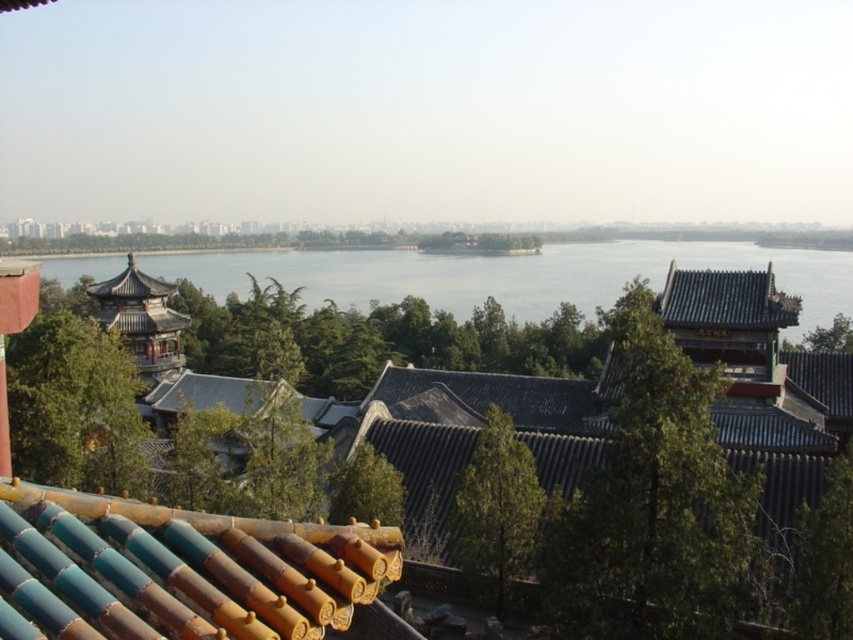
Question: Which point is farther to the camera?

Choices:
 (A) shiny dark blue tiled roof at upper right
 (B) blue water at center
 (C) teal glazed tiles at center

Answer: (B)

Question: In this image, where is teal glazed tiles at center located relative to shiny dark blue tiled roof at upper right?

Choices:
 (A) above
 (B) below

Answer: (B)

Question: Which point is farther to the camera?

Choices:
 (A) shiny dark blue tiled roof at upper right
 (B) teal glazed tiles at center

Answer: (A)

Question: Among these points, which one is nearest to the camera?

Choices:
 (A) (491, 272)
 (B) (90, 573)

Answer: (B)

Question: From the image, what is the correct spatial relationship of teal glazed tiles at center in relation to blue water at center?

Choices:
 (A) above
 (B) below

Answer: (B)

Question: Can you confirm if teal glazed tiles at center is positioned to the left of shiny dark blue tiled roof at upper right?

Choices:
 (A) yes
 (B) no

Answer: (A)